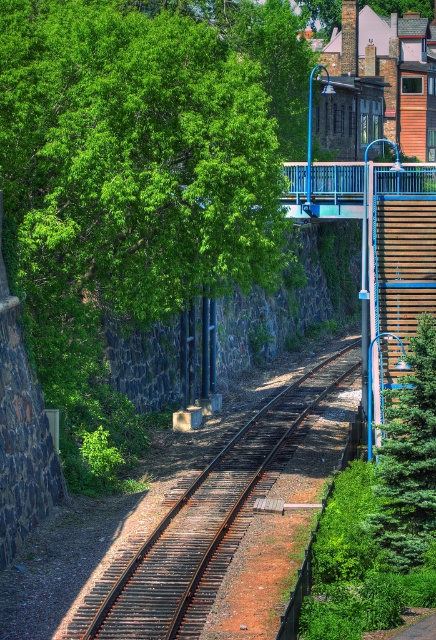
You are a maintenance worker needing to cross the rusty metal train track at center to reach the green textured evergreen at right for inspection. The safety regulations require a minimum clearance of 5 meters between the track and any object to ensure safe passage. Is the current distance sufficient?

The distance between the rusty metal train track at center and the green textured evergreen at right is 4.47 meters, which is less than the required 5 meters. Therefore, the current clearance is insufficient for safe passage according to the regulations.

Looking at this image, you are a landscape architect designing a new park near the railway. You need to decide which tree to preserve between the green leafy tree at upper left and the green textured evergreen at right. If you want to prioritize a larger tree for shade, which one should you choose?

The green leafy tree at upper left is larger in size than the green textured evergreen at right, so you should choose the green leafy tree at upper left for shade.